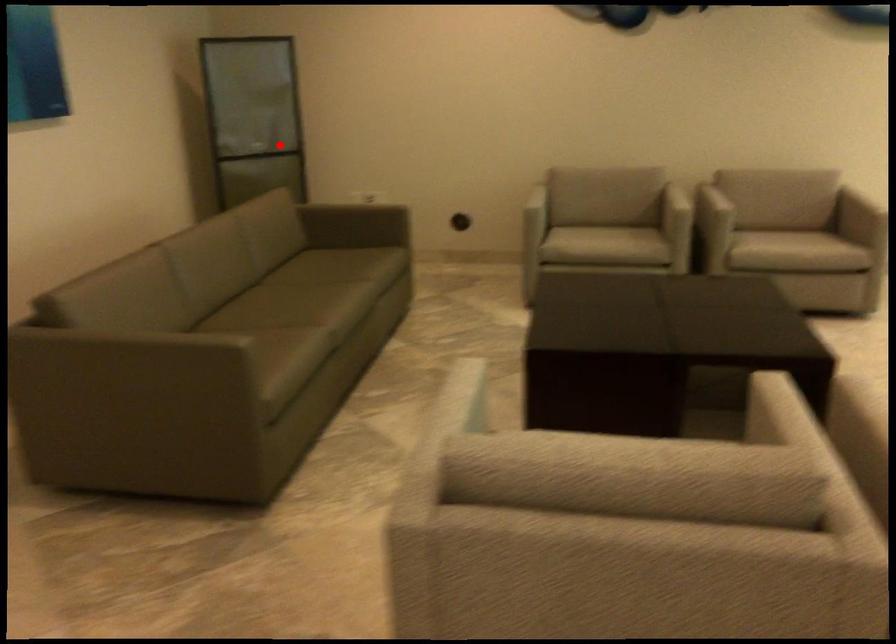
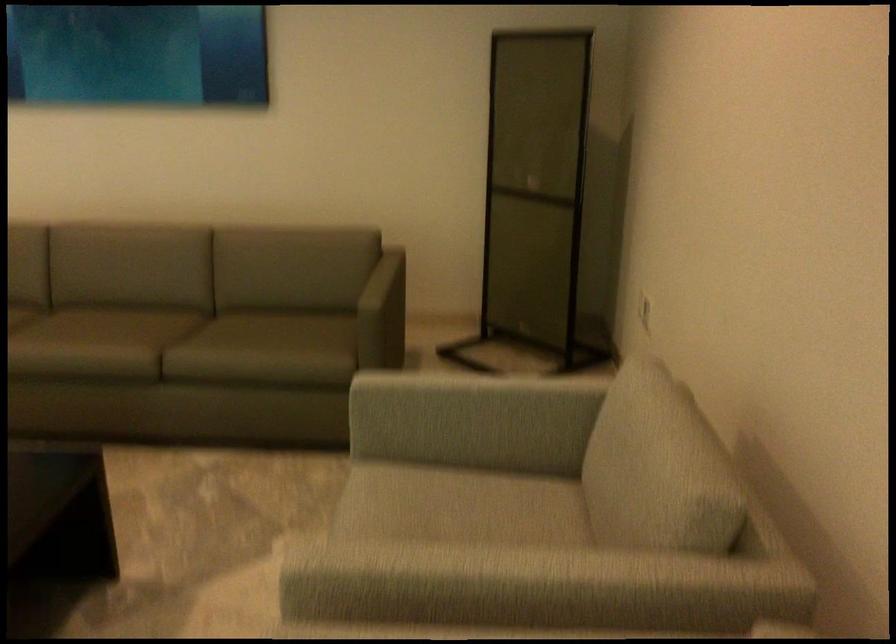
Question: I am providing you with two images of the same scene from different viewpoints. In image1, a red point is highlighted. Considering the same 3D point in image2, which of the following is correct?

Choices:
 (A) It is closer
 (B) It is farther

Answer: (A)